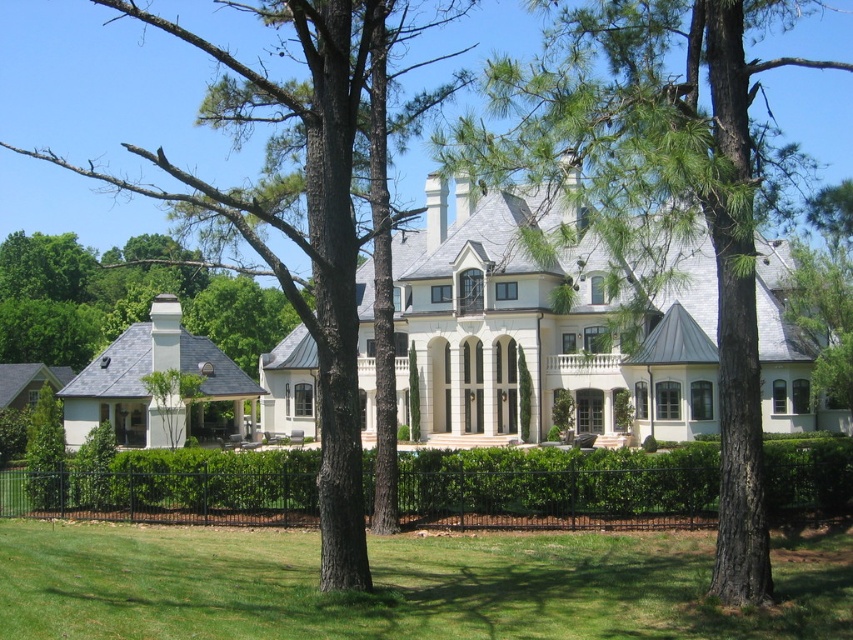
You are a landscape architect designing a walking path between the green textured tree at center and the green leafy hedge at center. The path must be exactly 45 feet long. Can you fit the path between them without overlapping either?

The distance between the green textured tree at center and the green leafy hedge at center is 46.78 feet. Since the required path length is 45 feet, which is shorter than the available space, the path can be placed between them without overlapping either object.

You are planning to plant a new flower bed in the garden. You have two areas available for planting. The first area is the green grass at lower center, and the second is the green leafy hedge at center. Which area has more space for planting more flowers?

The green leafy hedge at center has a larger size compared to the green grass at lower center, so it can accommodate more flowers.